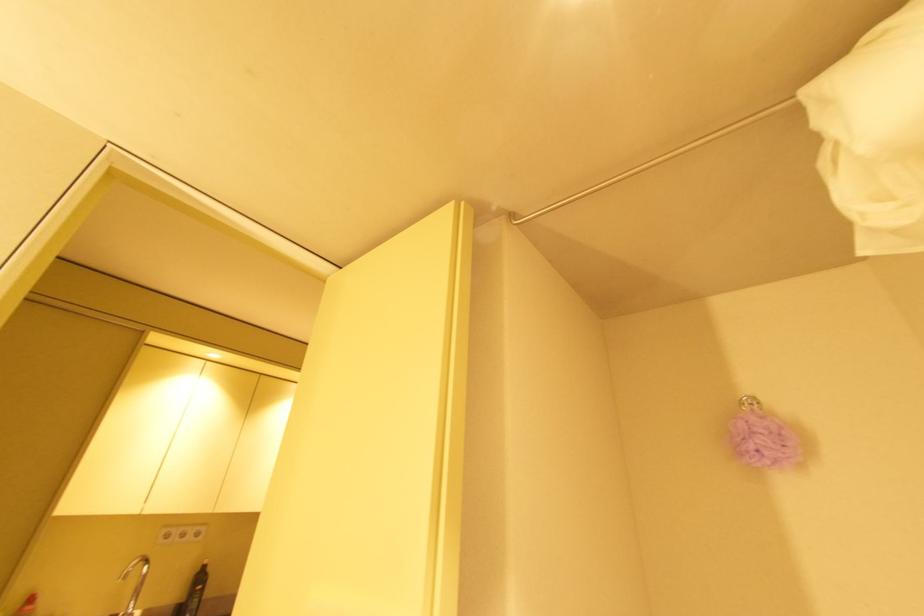
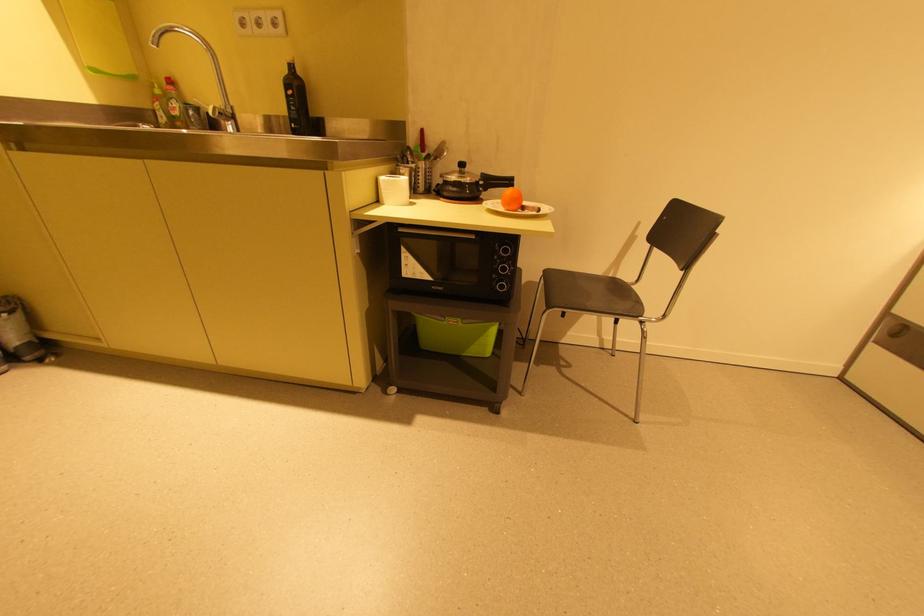
Find the pixel in the second image that matches pixel 169 531 in the first image.

(242, 17)